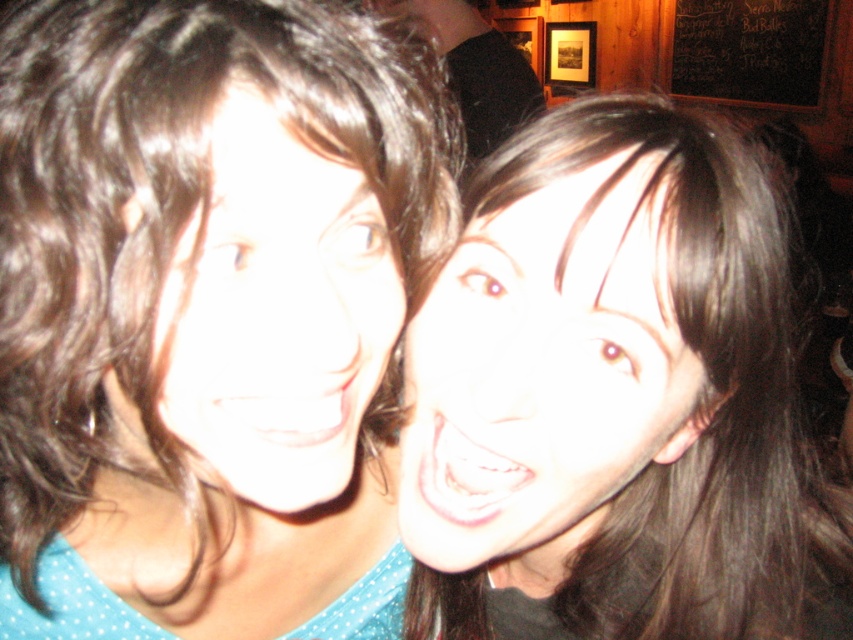
Question: Which of the following is the farthest from the observer?

Choices:
 (A) (404, 234)
 (B) (526, 444)
 (C) (184, 406)

Answer: (A)

Question: Which point is closer to the camera taking this photo?

Choices:
 (A) (495, 536)
 (B) (215, 212)

Answer: (B)

Question: Which object is farther from the camera taking this photo?

Choices:
 (A) smooth skin face at center
 (B) smooth brown hair at center

Answer: (A)

Question: Can you confirm if smooth skin face at center is positioned above matte skin face at center?

Choices:
 (A) yes
 (B) no

Answer: (B)

Question: Is smooth brown hair at center wider than matte skin face at center?

Choices:
 (A) yes
 (B) no

Answer: (A)

Question: Can you confirm if smooth skin face at center is smaller than matte skin face at center?

Choices:
 (A) no
 (B) yes

Answer: (A)